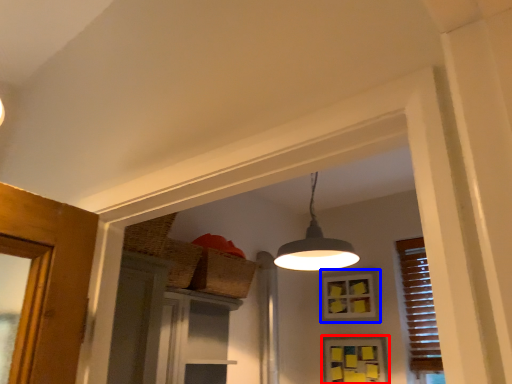
Question: Which point is closer to the camera, window (highlighted by a red box) or window (highlighted by a blue box)?

Choices:
 (A) window
 (B) window

Answer: (A)